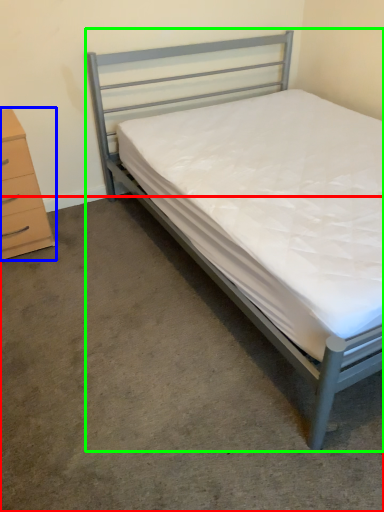
Question: Which object is the farthest from concrete (highlighted by a red box)? Choose among these: chest of drawers (highlighted by a blue box) or bed (highlighted by a green box).

Choices:
 (A) chest of drawers
 (B) bed

Answer: (B)